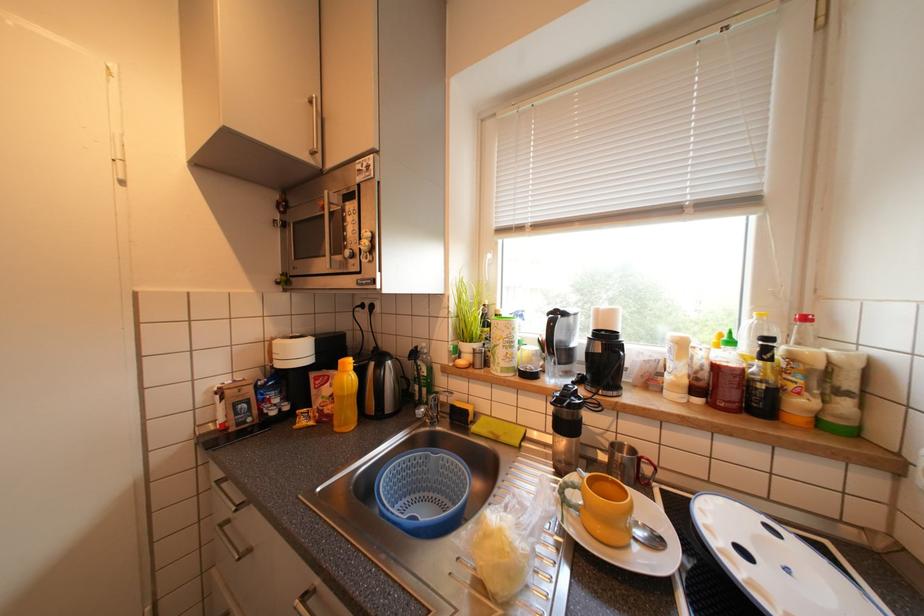
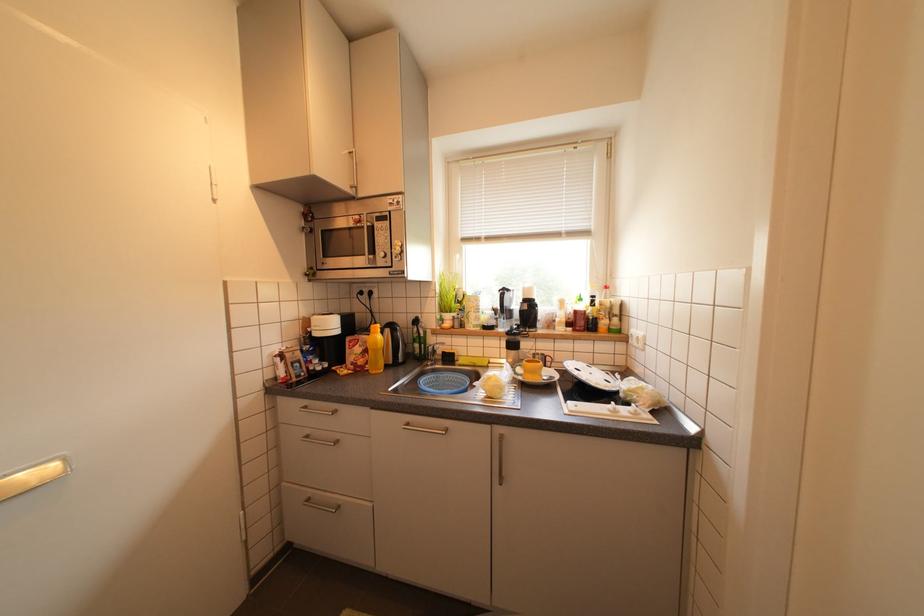
Question: How did the camera likely rotate?

Choices:
 (A) Left
 (B) Right
 (C) Up
 (D) Down

Answer: (B)